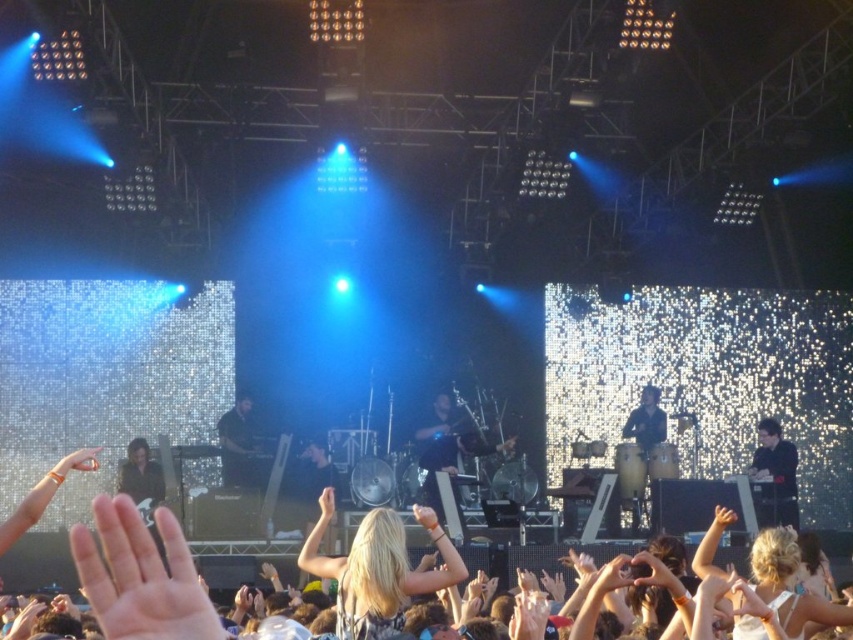
You are a photographer at the concert. You want to capture a photo that includes both the blonde hair at center and the smooth skin hand at upper center. Given that your camera has a maximum focus range of 60 feet, will you be able to fit both subjects into the same frame without moving closer?

The blonde hair at center and smooth skin hand at upper center are 59.65 feet apart. Since the distance between them is within the camera maximum focus range of 60 feet, you can fit both subjects into the same frame without moving closer.

In the concert scene, where is the blonde hair at center located in terms of coordinates?

The blonde hair at center is located at coordinates point (376, 573).

You are a photographer at the concert and want to capture a closeup of the drummer while avoiding the crowd. The drummer is at point (x=503, y=448) and the crowd is at point (x=238, y=612). Which point should you focus on to get a clearer shot of the drummer?

You should focus on point (x=503, y=448) where the drummer is located because point (x=238, y=612) is closer to the viewer and might obstruct the view of the drummer.